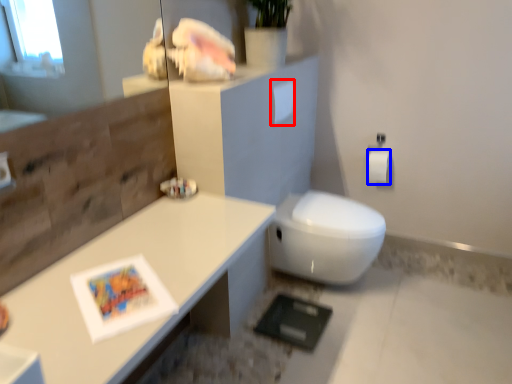
Question: Which object is further to the camera taking this photo, toilet paper (highlighted by a red box) or toilet paper (highlighted by a blue box)?

Choices:
 (A) toilet paper
 (B) toilet paper

Answer: (B)